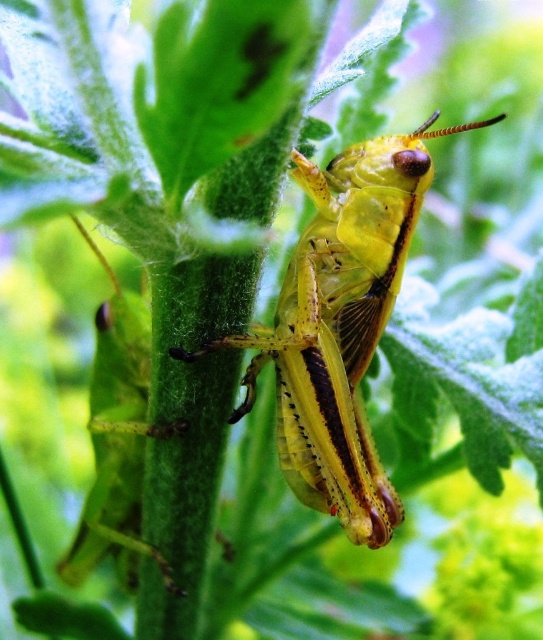
You are an entomologist observing two grasshoppers in the image. Which grasshopper, the yellow matte grasshopper at center or the green matte grasshopper at center, is positioned to the right?

The yellow matte grasshopper at center is positioned to the right of the green matte grasshopper at center.

You are an entomologist observing two grasshoppers in the image. The scene shows a yellow matte grasshopper at center and a green matte grasshopper at center. Which grasshopper is shorter in height?

The yellow matte grasshopper at center is not as tall as the green matte grasshopper at center, so the yellow one is shorter.

You are an entomologist examining a close up of a grasshopper on a plant stem. You notice two grasshoppers labeled yellow matte grasshopper at center and green matte grasshopper at center. Which grasshopper is sitting on top of the other?

The yellow matte grasshopper at center is positioned over the green matte grasshopper at center, so the yellow one is sitting on top of the green one.